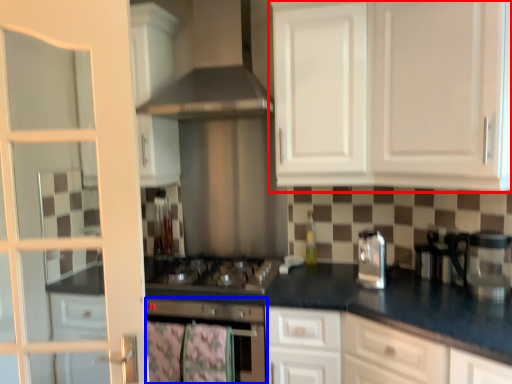
Question: Which point is closer to the camera, cabinetry (highlighted by a red box) or home appliance (highlighted by a blue box)?

Choices:
 (A) cabinetry
 (B) home appliance

Answer: (A)